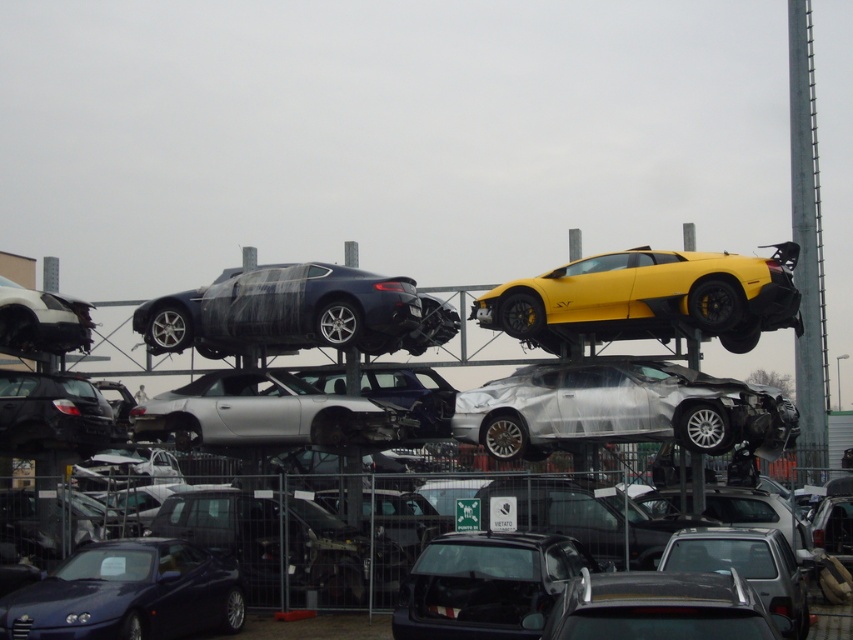
You are a delivery driver who needs to park your truck in the salvage yard. You see the yellow matte sports car at upper right and the satin black car at upper center. Which vehicle should you avoid parking near if you want to maximize space?

You should avoid parking near the yellow matte sports car at upper right because it is bigger than the satin black car at upper center, taking up more space.